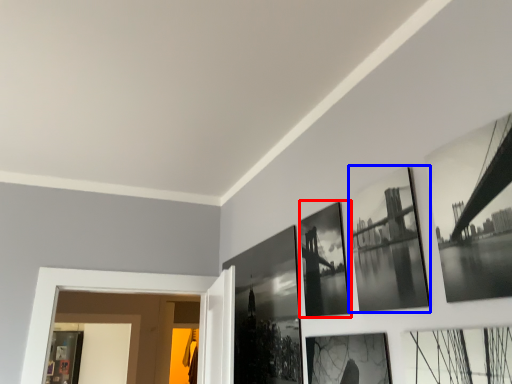
Question: Among these objects, which one is farthest to the camera, picture frame (highlighted by a red box) or picture frame (highlighted by a blue box)?

Choices:
 (A) picture frame
 (B) picture frame

Answer: (A)